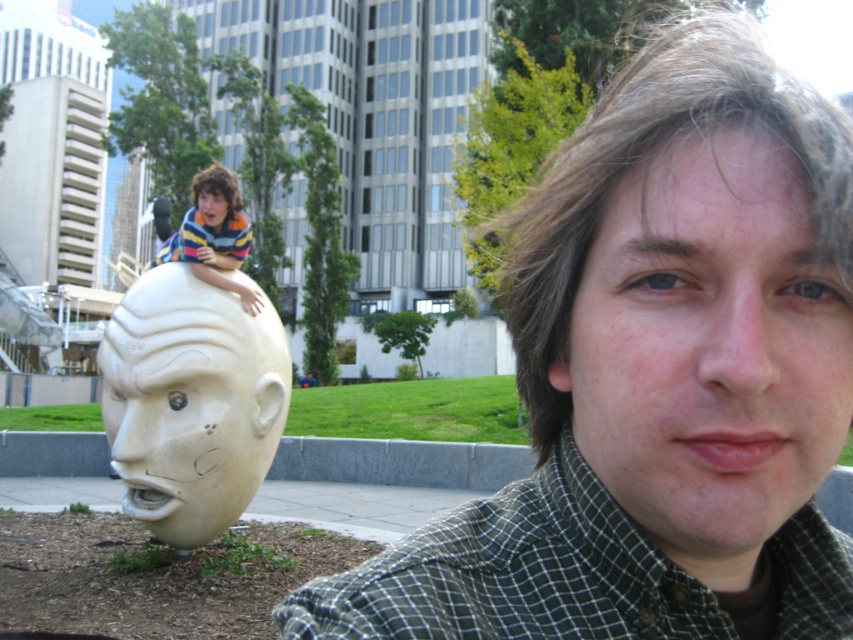
Between green checkered shirt at lower right and white stone head at center, which one appears on the right side from the viewer's perspective?

green checkered shirt at lower right is more to the right.

Can you confirm if green checkered shirt at lower right is positioned to the left of white stone head at center?

No, green checkered shirt at lower right is not to the left of white stone head at center.

This screenshot has width=853, height=640. I want to click on green checkered shirt at lower right, so click(515, 573).

Identify the location of green checkered shirt at lower right. pyautogui.click(x=515, y=573).

Which is behind, point (781, 490) or point (264, 406)?

Point (264, 406)

Does matte skin face at center have a greater width compared to white matte sculpture at left?

No.

The image size is (853, 640). Identify the location of matte skin face at center. (709, 348).

Which is more to the left, white matte sculpture at left or striped sweater at left?

striped sweater at left is more to the left.

Who is shorter, white matte sculpture at left or striped sweater at left?

With less height is white matte sculpture at left.

Locate an element on the screen. The width and height of the screenshot is (853, 640). white matte sculpture at left is located at coordinates (189, 417).

You are a GUI agent. You are given a task and a screenshot of the screen. Output one action in this format:
    pyautogui.click(x=<x>, y=<y>)
    Task: Click on the white matte sculpture at left
    This screenshot has width=853, height=640.
    Given the screenshot: What is the action you would take?
    pyautogui.click(x=189, y=417)